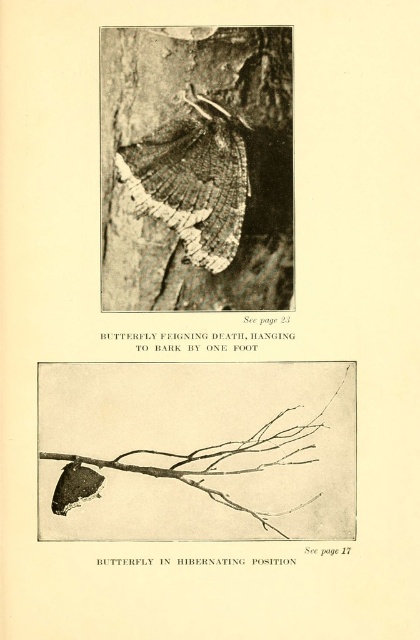
Does brown textured branch at lower left have a larger size compared to smooth bark tree trunk at center?

Actually, brown textured branch at lower left might be smaller than smooth bark tree trunk at center.

Based on the photo, is brown textured branch at lower left below smooth bark tree trunk at center?

Correct, brown textured branch at lower left is located below smooth bark tree trunk at center.

Find the location of `brown textured branch at lower left`. brown textured branch at lower left is located at coordinates (196, 451).

Locate an element on the screen. Image resolution: width=420 pixels, height=640 pixels. brown textured branch at lower left is located at coordinates (196, 451).